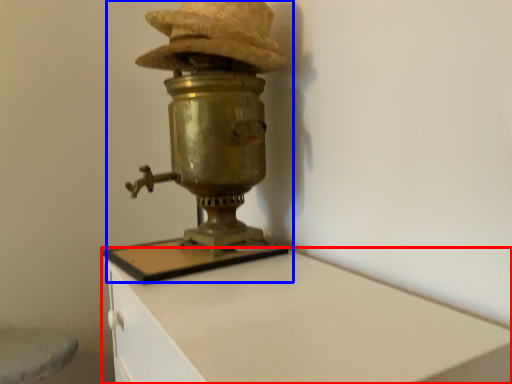
Question: Which object appears farthest to the camera in this image, furniture (highlighted by a red box) or table lamp (highlighted by a blue box)?

Choices:
 (A) furniture
 (B) table lamp

Answer: (B)